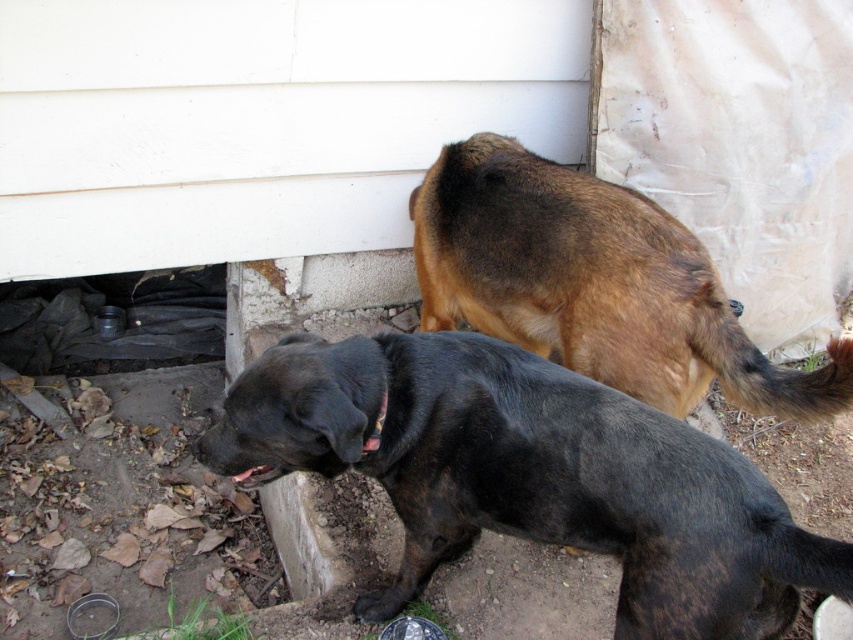
You are standing 5 feet away from the camera. You want to pet the black matte dog at lower center. Can you reach it without moving?

The black matte dog at lower center is 4.41 feet away from the camera. Since you are 5 feet away from the camera, you are 0.59 feet farther than the dog. Therefore, you can reach the black matte dog at lower center without moving.

You are standing at the point labeled point (x=595, y=284). Which direction should you go to reach the black dog with brown markings in the foreground?

The point labeled point (x=595, y=284) is on the brown furry dog at upper right. To reach the black dog with brown markings in the foreground, you should move downward since the foreground is closer to the viewer.

You are standing at the origin point of the coordinate system where the white wall is the y axis and the ground is the x axis. The black matte dog at lower center is located at point [531,476]. If you want to walk directly to the black matte dog at lower center, which direction should you move in terms of x and y coordinates?

To reach the black matte dog at lower center located at point [531,476], you should move in the positive x and positive y direction since both coordinates are greater than zero.